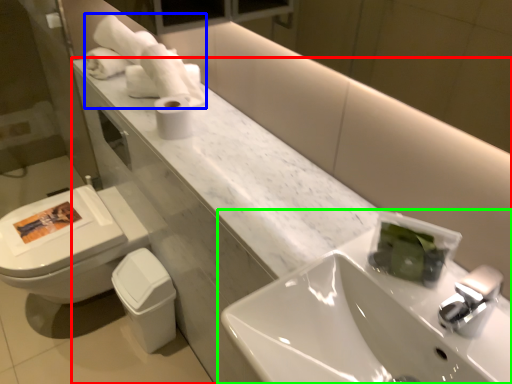
Question: Based on their relative distances, which object is nearer to counter (highlighted by a red box)? Choose from bath towel (highlighted by a blue box) and sink (highlighted by a green box).

Choices:
 (A) bath towel
 (B) sink

Answer: (B)